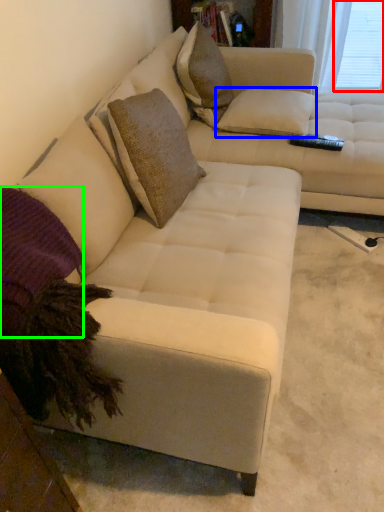
Question: Considering the real-world distances, which object is closest to window screen (highlighted by a red box)? pillow (highlighted by a blue box) or pillow (highlighted by a green box).

Choices:
 (A) pillow
 (B) pillow

Answer: (A)